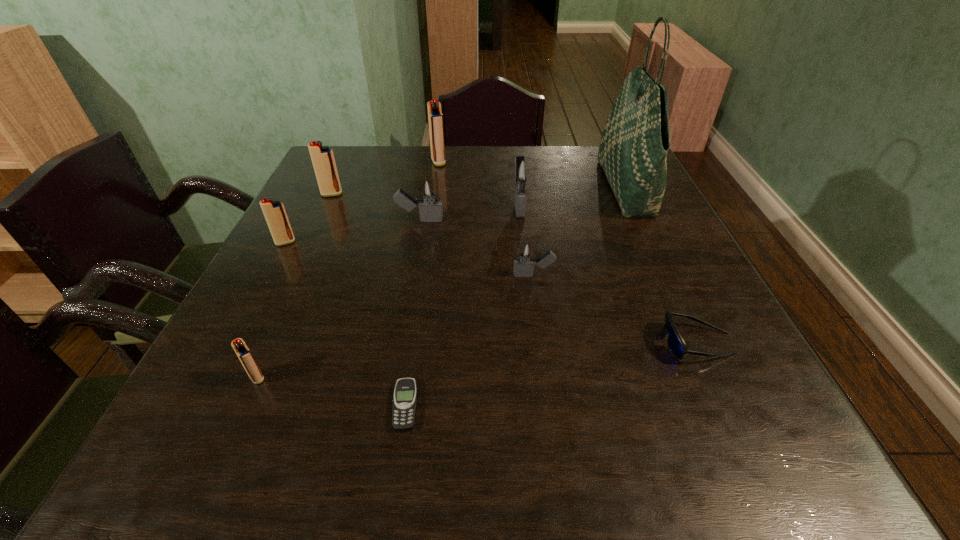
The height and width of the screenshot is (540, 960). I want to click on green tote bag, so click(x=634, y=144).

This screenshot has width=960, height=540. I want to click on the tallest object, so click(634, 144).

Locate an element on the screen. This screenshot has width=960, height=540. the biggest red igniter is located at coordinates (435, 117).

Image resolution: width=960 pixels, height=540 pixels. Identify the location of the farthest igniter. (435, 117).

This screenshot has height=540, width=960. Identify the location of the second biggest red igniter. (322, 157).

This screenshot has height=540, width=960. Identify the location of the biggest gray igniter. (522, 172).

In order to click on the second biggest gray igniter in this screenshot , I will do `click(428, 189)`.

The image size is (960, 540). I want to click on the third farthest red igniter, so click(274, 212).

Find the location of a particular element. the leftmost red igniter is located at coordinates click(x=274, y=212).

Identify the location of the nearest red igniter. (245, 356).